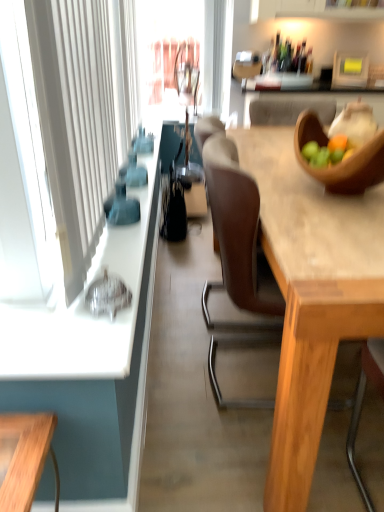
At what (x,y) coordinates should I click in order to perform the action: click on free space to the left of wooden bowl at upper right. Please return your answer as a coordinate pair (x, y). Looking at the image, I should click on (279, 198).